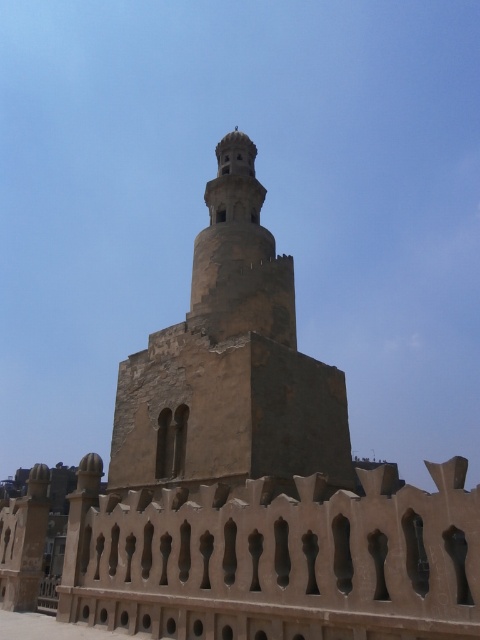
Question: Is brown stone fence at lower center above brown stone tower at center?

Choices:
 (A) yes
 (B) no

Answer: (B)

Question: In this image, where is brown stone fence at lower center located relative to brown stone tower at center?

Choices:
 (A) above
 (B) below

Answer: (B)

Question: Which point is farther from the camera taking this photo?

Choices:
 (A) tap(263, 435)
 (B) tap(247, 618)

Answer: (A)

Question: Which of the following is the farthest from the observer?

Choices:
 (A) brown stone tower at center
 (B) brown stone fence at lower center

Answer: (A)

Question: Does brown stone fence at lower center have a lesser width compared to brown stone tower at center?

Choices:
 (A) yes
 (B) no

Answer: (B)

Question: Which point is closer to the camera taking this photo?

Choices:
 (A) (203, 588)
 (B) (271, 445)

Answer: (A)